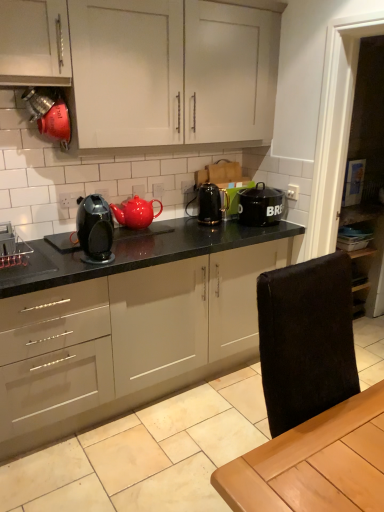
In order to click on free spot to the right of matte black coffee maker at center in this screenshot , I will do `click(125, 259)`.